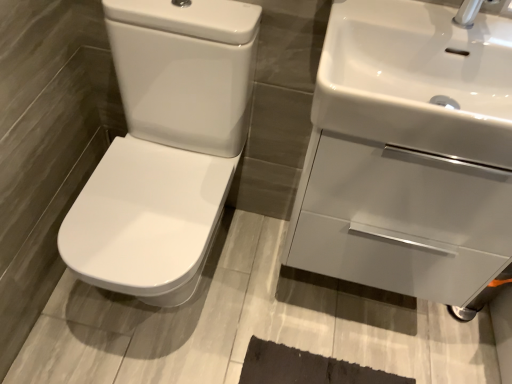
Question: Is point (373, 34) closer or farther from the camera than point (120, 44)?

Choices:
 (A) farther
 (B) closer

Answer: (B)

Question: In terms of height, does white glossy sink at upper right, the 2th sink viewed from the front, look taller or shorter compared to white glossy toilet at left?

Choices:
 (A) short
 (B) tall

Answer: (A)

Question: Which of these objects is positioned closest to the white glossy sink at upper right, which appears as the second sink when viewed from the back?

Choices:
 (A) white glossy toilet at left
 (B) white glossy sink at upper right, the 2th sink viewed from the front

Answer: (B)

Question: Which object is positioned farthest from the white glossy sink at upper right, which appears as the second sink when viewed from the back?

Choices:
 (A) white glossy sink at upper right, the 2th sink viewed from the front
 (B) white glossy toilet at left

Answer: (B)